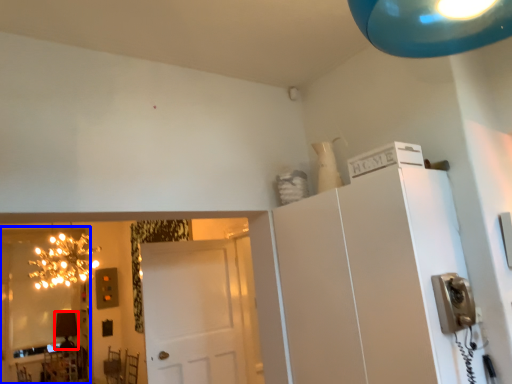
Question: Among these objects, which one is farthest to the camera, lamp (highlighted by a red box) or mirror (highlighted by a blue box)?

Choices:
 (A) lamp
 (B) mirror

Answer: (A)